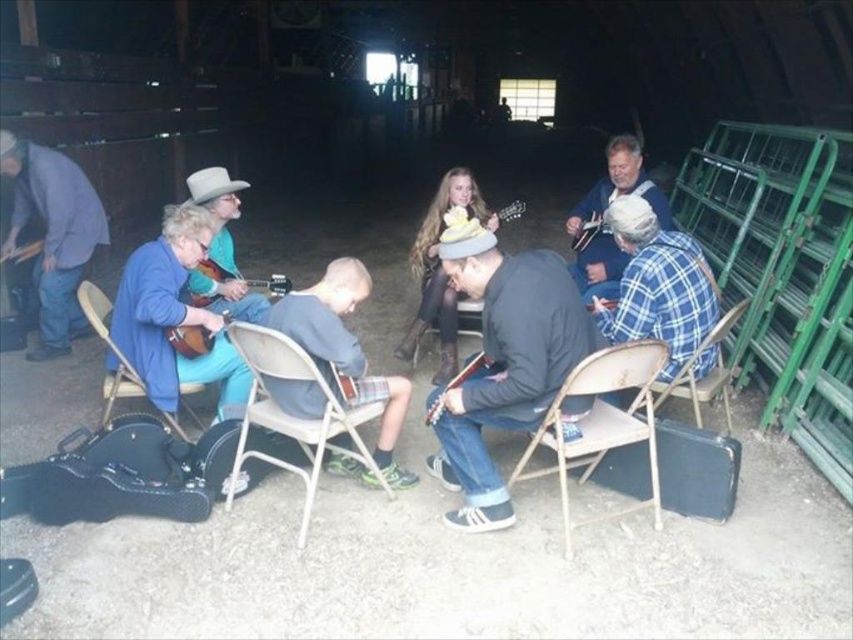
You are organizing a small concert in the barn and need to ensure that the gray fabric shirt at center and the metallic silver chair at center can be seen clearly by the audience. Given their sizes, which object should be placed closer to the front for better visibility?

The gray fabric shirt at center is smaller than the metallic silver chair at center, so placing the gray fabric shirt at center closer to the front will ensure it is more visible to the audience.

You are standing at the entrance of the barn and want to reach the metallic silver chair at center without stepping on the gray fabric shirt at center. Is this possible?

The gray fabric shirt at center is further to the viewer than the metallic silver chair at center, so the metallic silver chair at center is behind the gray fabric shirt at center. Therefore, you can walk around the gray fabric shirt at center to reach the metallic silver chair at center without stepping on it.